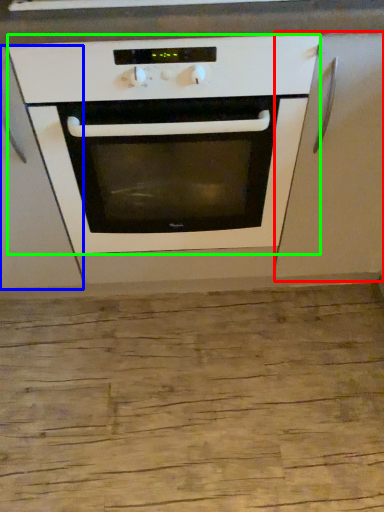
Question: Which object is positioned closest to cabinetry (highlighted by a red box)? Select from cabinetry (highlighted by a blue box) and oven (highlighted by a green box).

Choices:
 (A) cabinetry
 (B) oven

Answer: (B)